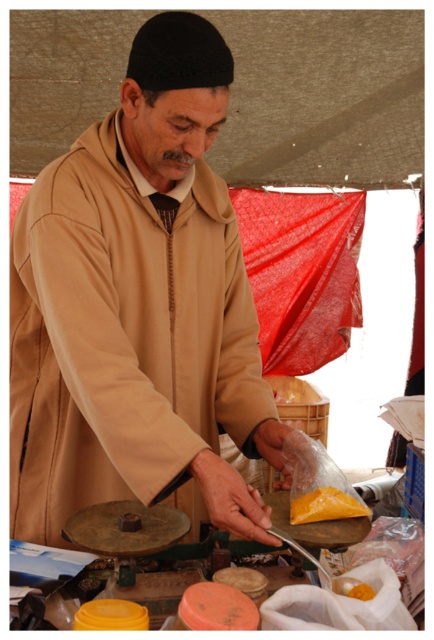
Question: Can you confirm if yellow powder at center is positioned to the right of orange powder at center?

Choices:
 (A) yes
 (B) no

Answer: (B)

Question: Is yellow powder at center to the right of orange powder at center from the viewer's perspective?

Choices:
 (A) yes
 (B) no

Answer: (B)

Question: Which point appears closest to the camera in this image?

Choices:
 (A) (368, 509)
 (B) (351, 580)

Answer: (B)

Question: Can you confirm if yellow powder at center is positioned to the left of orange powder at center?

Choices:
 (A) yes
 (B) no

Answer: (A)

Question: Among these points, which one is nearest to the camera?

Choices:
 (A) (324, 509)
 (B) (76, 372)
 (C) (352, 595)

Answer: (C)

Question: Which object appears farthest from the camera in this image?

Choices:
 (A) beige fabric man at center
 (B) yellow powder at center
 (C) orange powder at center

Answer: (B)